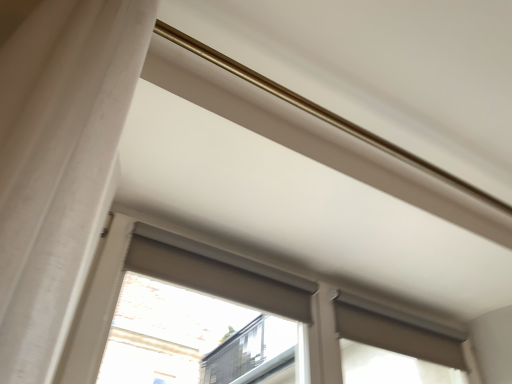
Question: From the image's perspective, would you say matte gray roller blind at upper right, which appears as the first window when ordered from the bottom, is shown under matte gray roller shade at upper center?

Choices:
 (A) no
 (B) yes

Answer: (B)

Question: Can you confirm if matte gray roller blind at upper right, which is counted as the 2th window, starting from the top, is taller than matte gray roller shade at upper center?

Choices:
 (A) yes
 (B) no

Answer: (A)

Question: From the image's perspective, is matte gray roller blind at upper right, which appears as the first window when ordered from the bottom, located above matte gray roller shade at upper center?

Choices:
 (A) yes
 (B) no

Answer: (B)

Question: From a real-world perspective, does matte gray roller blind at upper right, which appears as the first window when ordered from the bottom, sit lower than matte gray roller shade at upper center?

Choices:
 (A) no
 (B) yes

Answer: (A)

Question: Is matte gray roller blind at upper right, which is counted as the 2th window, starting from the top, bigger than matte gray roller shade at upper center?

Choices:
 (A) yes
 (B) no

Answer: (A)

Question: Is matte gray roller blind at upper right, which is counted as the 2th window, starting from the top, behind matte gray roller shade at upper center?

Choices:
 (A) no
 (B) yes

Answer: (B)

Question: Is matte gray roller blind at center, acting as the 1th window starting from the top, facing towards matte gray roller shade at upper center?

Choices:
 (A) no
 (B) yes

Answer: (B)

Question: Is matte gray roller blind at center, which is the second window in bottom-to-top order, located outside matte gray roller shade at upper center?

Choices:
 (A) no
 (B) yes

Answer: (B)

Question: Is the depth of matte gray roller blind at center, which is the second window in bottom-to-top order, less than that of matte gray roller shade at upper center?

Choices:
 (A) no
 (B) yes

Answer: (B)

Question: Does matte gray roller blind at center, acting as the 1th window starting from the top, lie behind matte gray roller shade at upper center?

Choices:
 (A) no
 (B) yes

Answer: (A)

Question: Does matte gray roller blind at center, acting as the 1th window starting from the top, have a larger size compared to matte gray roller shade at upper center?

Choices:
 (A) no
 (B) yes

Answer: (B)

Question: From a real-world perspective, is matte gray roller blind at center, which is the second window in bottom-to-top order, located beneath matte gray roller shade at upper center?

Choices:
 (A) yes
 (B) no

Answer: (A)

Question: From the image's perspective, is matte gray roller blind at upper right, which is counted as the 2th window, starting from the top, on matte gray roller blind at center, which is the second window in bottom-to-top order?

Choices:
 (A) yes
 (B) no

Answer: (B)